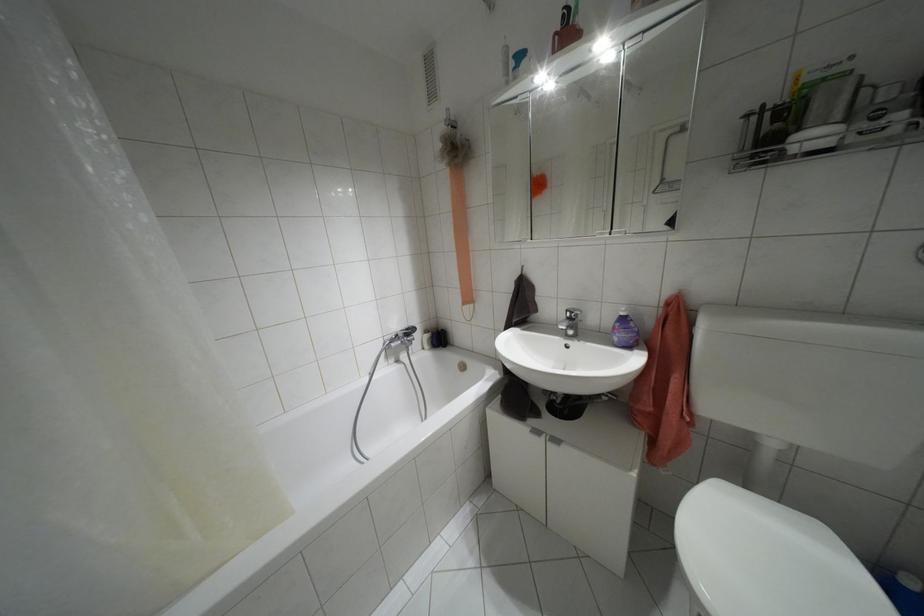
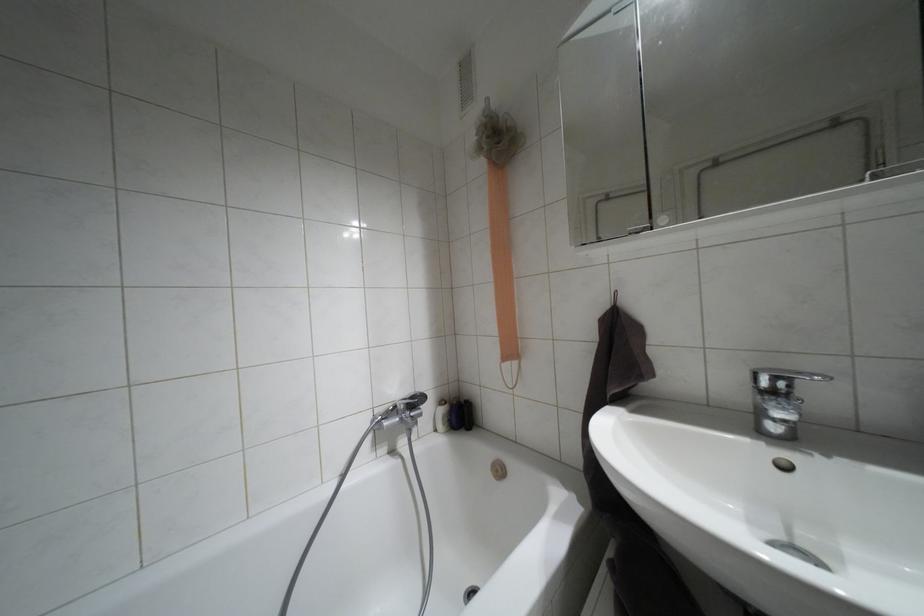
Question: How did the camera likely rotate?

Choices:
 (A) Left
 (B) Right
 (C) Up
 (D) Down

Answer: (C)